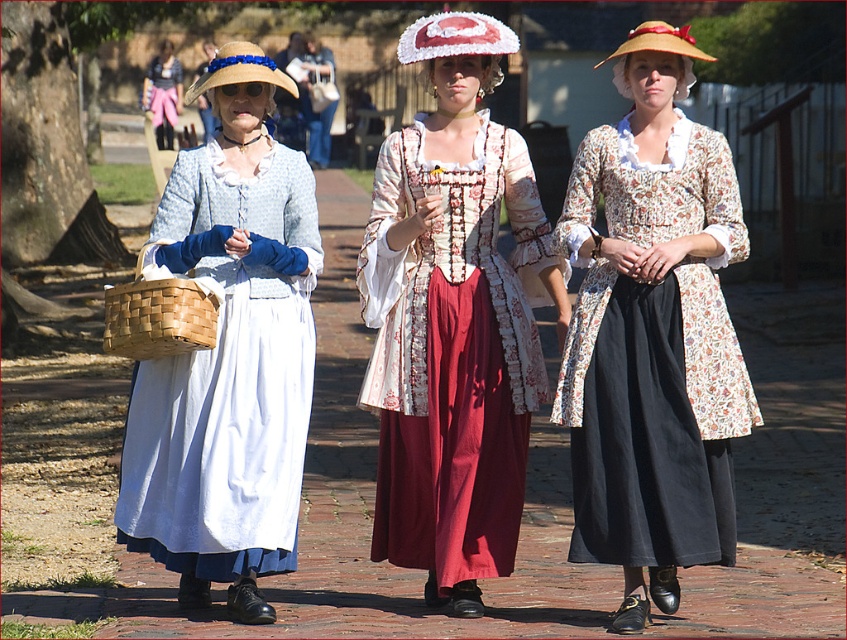
Looking at this image, you are a photographer planning to take a group photo of the floral fabric dress at center and the matte blue dress at left. To ensure both are in focus, you need to know their heights. Which dress is shorter?

The floral fabric dress at center is shorter than the matte blue dress at left.